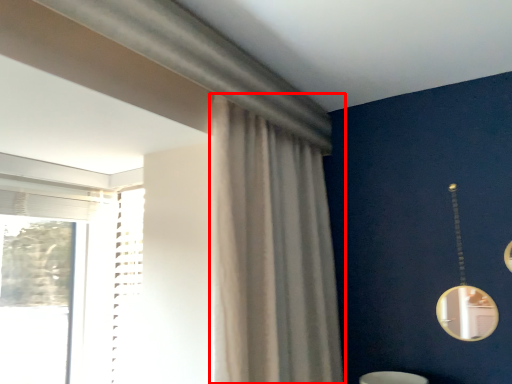
Question: Considering the relative positions of curtain (annotated by the red box) and mirror in the image provided, where is curtain (annotated by the red box) located with respect to the staircase?

Choices:
 (A) right
 (B) left

Answer: (B)